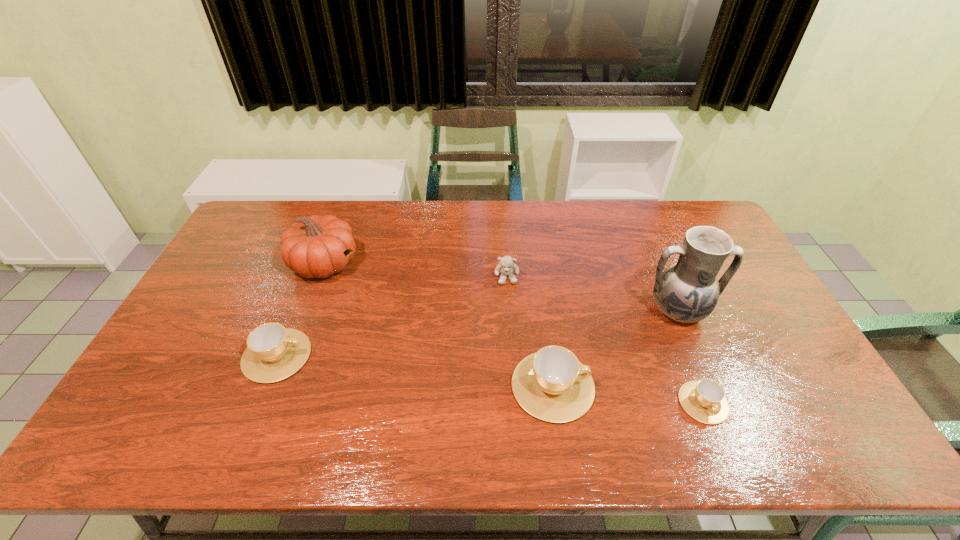
This screenshot has height=540, width=960. I want to click on vacant region located 0.050m on the front-facing side of the tallest object, so click(693, 347).

The width and height of the screenshot is (960, 540). What are the coordinates of `vacant space located on the face of the pumpkin` in the screenshot? It's located at (454, 264).

I want to click on vacant point at the far edge, so click(555, 207).

In the image, there is a desktop. In order to click on vacant space at the near edge in this screenshot , I will do `click(608, 409)`.

Find the location of `free region at the left edge`. free region at the left edge is located at coordinates (233, 273).

Find the location of a particular element. Image resolution: width=960 pixels, height=540 pixels. free space at the right edge of the desktop is located at coordinates (741, 354).

Identify the location of free space between the second cup from left to right and the second tallest cup. click(415, 371).

You are a GUI agent. You are given a task and a screenshot of the screen. Output one action in this format:
    pyautogui.click(x=<x>, y=<y>)
    Task: Click on the unoccupied area between the pitcher and the second shortest cup
    The image size is (960, 540).
    Given the screenshot: What is the action you would take?
    pyautogui.click(x=477, y=334)

This screenshot has width=960, height=540. I want to click on vacant area that lies between the fifth shortest object and the second tallest cup, so point(300,309).

This screenshot has width=960, height=540. Find the location of `vacant area between the second cup from left to right and the tallest object`. vacant area between the second cup from left to right and the tallest object is located at coordinates (615, 349).